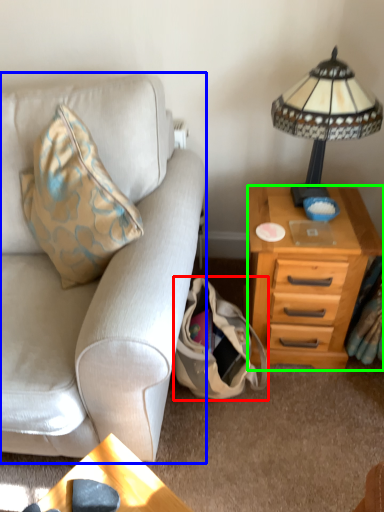
Question: Which is farther away from handbag (highlighted by a red box)? studio couch (highlighted by a blue box) or nightstand (highlighted by a green box)?

Choices:
 (A) studio couch
 (B) nightstand

Answer: (A)